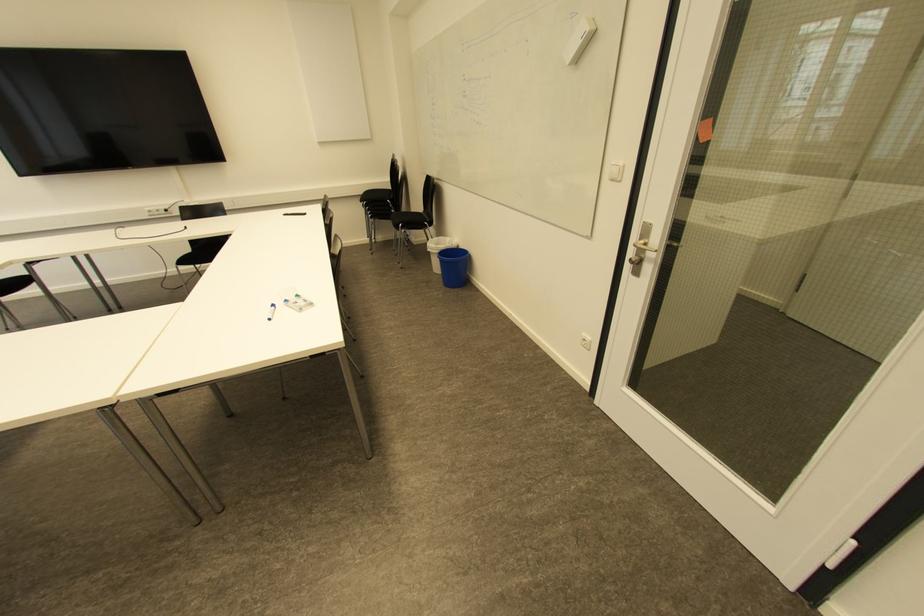
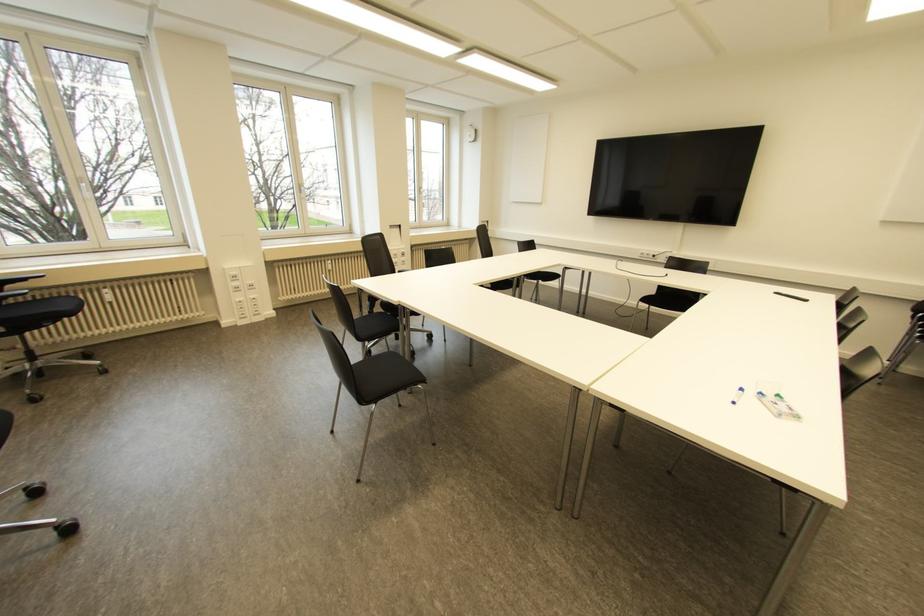
The point at (273, 306) is marked in the first image. Where is the corresponding point in the second image?

(739, 390)